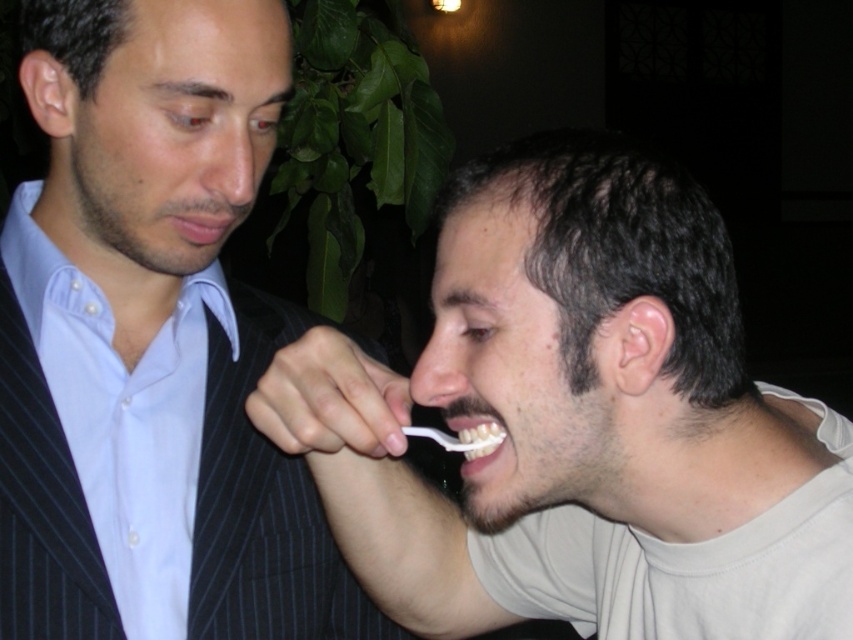
Question: Based on their relative distances, which object is nearer to the matte skin mouth at center?

Choices:
 (A) white plastic toothbrush at lower center
 (B) white matte toothbrush at upper left

Answer: (B)

Question: Can you confirm if white matte toothbrush at upper left is positioned to the right of white glossy toothbrush at lower center?

Choices:
 (A) yes
 (B) no

Answer: (B)

Question: Which point is farther to the camera?

Choices:
 (A) matte skin mouth at center
 (B) white glossy toothbrush at lower center

Answer: (A)

Question: Can you confirm if white matte toothbrush at upper left is positioned to the right of white glossy toothbrush at lower center?

Choices:
 (A) yes
 (B) no

Answer: (B)

Question: Which of the following is the farthest from the observer?

Choices:
 (A) (456, 451)
 (B) (349, 538)
 (C) (181, 220)

Answer: (A)

Question: Is white plastic fork at upper right positioned before white glossy toothbrush at lower center?

Choices:
 (A) no
 (B) yes

Answer: (B)